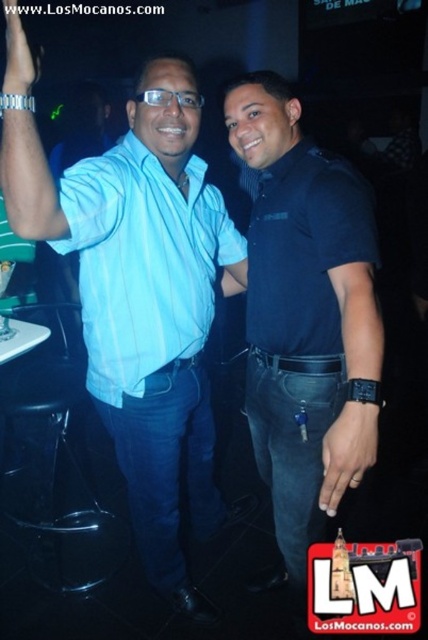
Does light blue striped shirt at center have a lesser width compared to black leather watch at center?

No, light blue striped shirt at center is not thinner than black leather watch at center.

Is light blue striped shirt at center bigger than black leather watch at center?

Indeed, light blue striped shirt at center has a larger size compared to black leather watch at center.

This screenshot has height=640, width=428. Describe the element at coordinates (142, 262) in the screenshot. I see `light blue striped shirt at center` at that location.

Identify the location of light blue striped shirt at center. The width and height of the screenshot is (428, 640). (142, 262).

From the picture: Who is more forward, (208, 442) or (372, 428)?

Point (372, 428) is in front.

Between light blue shirt at center and black leather watch at center, which one appears on the left side from the viewer's perspective?

From the viewer's perspective, light blue shirt at center appears more on the left side.

Is point (228, 282) positioned behind point (350, 440)?

Yes.

Locate an element on the screen. The image size is (428, 640). light blue shirt at center is located at coordinates (140, 296).

Based on the photo, is dark blue shirt at center further to camera compared to black leather watch at center?

Yes, it is behind black leather watch at center.

Does point (261, 138) come farther from viewer compared to point (341, 419)?

Yes, point (261, 138) is farther from viewer.

The width and height of the screenshot is (428, 640). What are the coordinates of `dark blue shirt at center` in the screenshot? It's located at (305, 314).